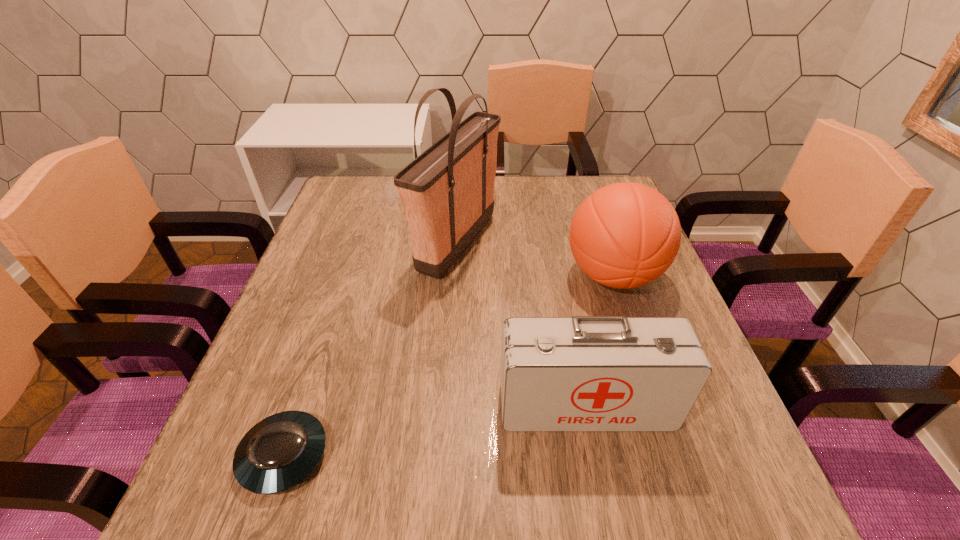
At what (x,y) coordinates should I click in order to perform the action: click on object that is the third closest to the third tallest object. Please return your answer as a coordinate pair (x, y). The image size is (960, 540). Looking at the image, I should click on (279, 452).

Identify the location of free spot that satisfies the following two spatial constraints: 1. on the back side of the shopping bag; 2. on the left side of the leftmost object. The height and width of the screenshot is (540, 960). (356, 242).

I want to click on vacant area in the image that satisfies the following two spatial constraints: 1. on the back side of the basketball; 2. on the left side of the saucer, so click(x=346, y=275).

Image resolution: width=960 pixels, height=540 pixels. Find the location of `free space that satisfies the following two spatial constraints: 1. on the back side of the saucer; 2. on the left side of the third shortest object`. free space that satisfies the following two spatial constraints: 1. on the back side of the saucer; 2. on the left side of the third shortest object is located at coordinates (346, 275).

The height and width of the screenshot is (540, 960). What are the coordinates of `free space that satisfies the following two spatial constraints: 1. on the front side of the shopping bag; 2. on the right side of the third shortest object` in the screenshot? It's located at (455, 275).

The height and width of the screenshot is (540, 960). Identify the location of vacant space that satisfies the following two spatial constraints: 1. on the front side of the shopping bag; 2. on the left side of the basketball. (455, 275).